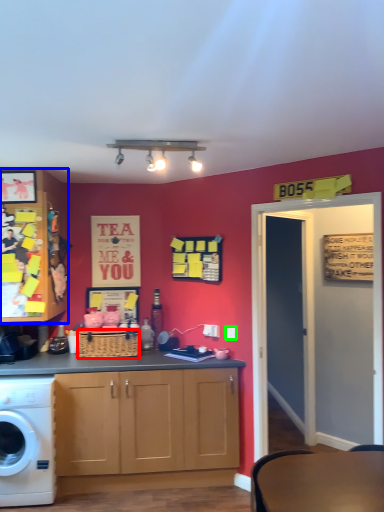
Question: Which is farther away from picnic basket (highlighted by a red box)? cabinetry (highlighted by a blue box) or power outlet (highlighted by a green box)?

Choices:
 (A) cabinetry
 (B) power outlet

Answer: (B)